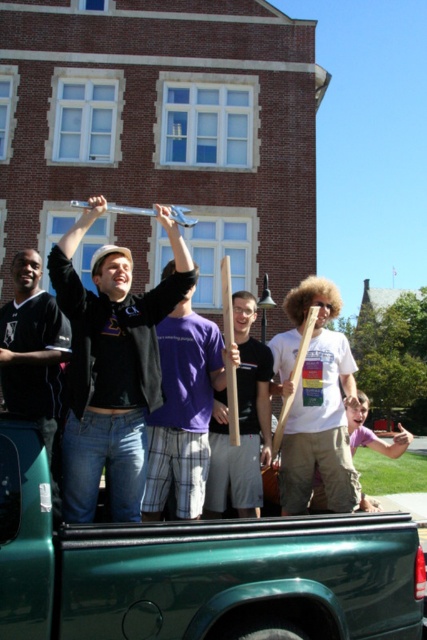
Question: Can you confirm if metallic silver plectrum at upper center is thinner than purple cotton t-shirt at center?

Choices:
 (A) yes
 (B) no

Answer: (B)

Question: Where is green matte truck at upper center located in relation to wooden stick at center in the image?

Choices:
 (A) left
 (B) right

Answer: (A)

Question: Considering the real-world distances, which object is closest to the wooden pole at center?

Choices:
 (A) metallic silver plectrum at upper center
 (B) wooden stick at center
 (C) green matte truck at upper center
 (D) matte black shirt at left

Answer: (B)

Question: Which object is positioned farthest from the matte black shirt at left?

Choices:
 (A) metallic silver plectrum at upper center
 (B) wooden pole at center
 (C) green matte truck at upper center
 (D) wooden stick at center

Answer: (D)

Question: Is purple cotton t-shirt at center wider than wooden pole at center?

Choices:
 (A) yes
 (B) no

Answer: (A)

Question: Among these points, which one is farthest from the camera?

Choices:
 (A) pos(319,321)
 (B) pos(142,298)
 (C) pos(61,349)

Answer: (A)